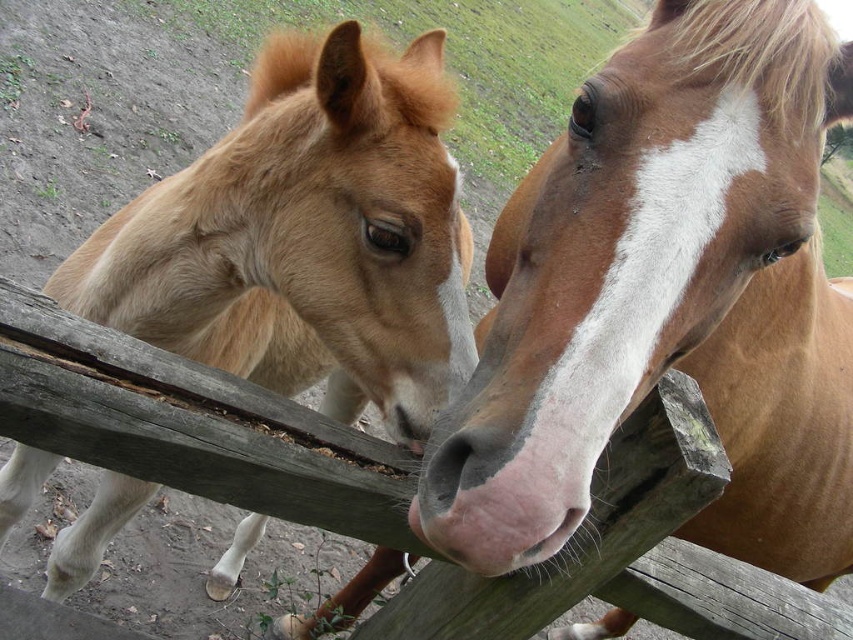
Question: Which point is farther from the camera taking this photo?

Choices:
 (A) (706, 589)
 (B) (421, 294)

Answer: (A)

Question: Among these objects, which one is nearest to the camera?

Choices:
 (A) wooden fence at center
 (B) brown glossy horse at center
 (C) light brown fur at left

Answer: (B)

Question: Does brown glossy horse at center have a lesser width compared to light brown fur at left?

Choices:
 (A) no
 (B) yes

Answer: (A)

Question: Does light brown fur at left appear under wooden fence at center?

Choices:
 (A) yes
 (B) no

Answer: (B)

Question: Which of these objects is positioned farthest from the wooden fence at center?

Choices:
 (A) brown glossy horse at center
 (B) light brown fur at left

Answer: (A)

Question: Is light brown fur at left further to camera compared to wooden fence at center?

Choices:
 (A) yes
 (B) no

Answer: (A)